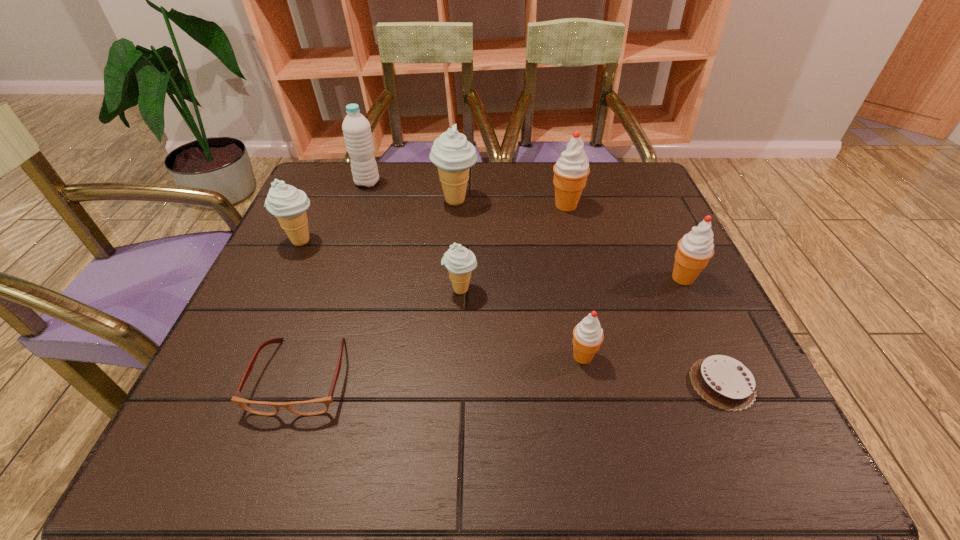
Locate an element on the screen. This screenshot has width=960, height=540. the eighth tallest object is located at coordinates (317, 406).

Find the location of a particular element. The image size is (960, 540). spectacles is located at coordinates 317,406.

Where is `the shortest object`? Image resolution: width=960 pixels, height=540 pixels. the shortest object is located at coordinates (726, 383).

What are the coordinates of `free region located on the right of the white water bottle` in the screenshot? It's located at (500, 183).

Locate an element on the screen. This screenshot has height=540, width=960. free region located 0.050m on the front of the farthest red icecream is located at coordinates (571, 227).

Where is `free space located 0.080m on the left of the biggest beige icecream`? free space located 0.080m on the left of the biggest beige icecream is located at coordinates (403, 201).

The width and height of the screenshot is (960, 540). I want to click on blank space located on the front of the second nearest red icecream, so (x=702, y=318).

You are a GUI agent. You are given a task and a screenshot of the screen. Output one action in this format:
    pyautogui.click(x=<x>, y=<y>)
    Task: Click on the vacant space located 0.260m on the back of the second nearest beige icecream
    
    Given the screenshot: What is the action you would take?
    pyautogui.click(x=331, y=174)

Identify the location of vacant point located 0.400m on the left of the smallest beige icecream. (256, 290).

The image size is (960, 540). What are the coordinates of `free region located 0.170m on the back of the nearest red icecream` in the screenshot? It's located at (567, 282).